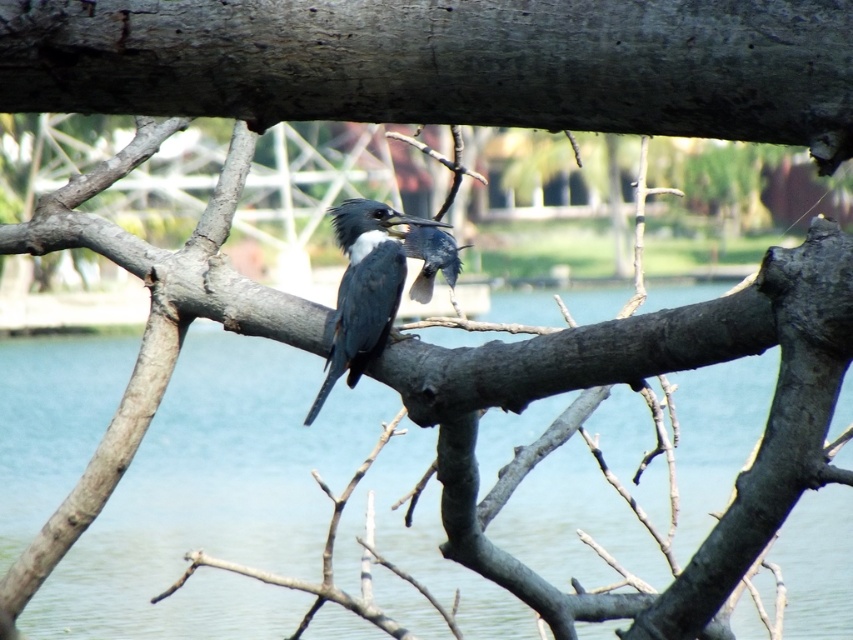
Question: Does transparent water at branch center come behind shiny blue bird at center?

Choices:
 (A) no
 (B) yes

Answer: (A)

Question: Does transparent water at branch center appear under shiny blue bird at center?

Choices:
 (A) no
 (B) yes

Answer: (B)

Question: Does transparent water at branch center have a lesser width compared to blue-gray feathers at center?

Choices:
 (A) yes
 (B) no

Answer: (B)

Question: Considering the real-world distances, which object is farthest from the transparent water at branch center?

Choices:
 (A) shiny blue bird at center
 (B) blue-gray feathers at center

Answer: (B)

Question: Estimate the real-world distances between objects in this image. Which object is farther from the blue-gray feathers at center?

Choices:
 (A) shiny blue bird at center
 (B) transparent water at branch center

Answer: (B)

Question: Which is farther from the shiny blue bird at center?

Choices:
 (A) transparent water at branch center
 (B) blue-gray feathers at center

Answer: (A)